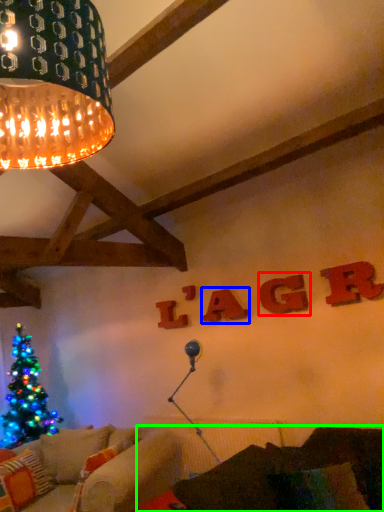
Question: Which is nearer to the letter (highlighted by a red box)? letter (highlighted by a blue box) or couch (highlighted by a green box).

Choices:
 (A) letter
 (B) couch

Answer: (A)